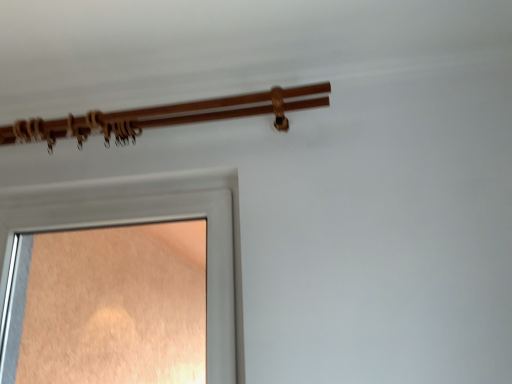
At what (x,y) coordinates should I click in order to perform the action: click on brown wooden clothesline at upper center. Please return your answer as a coordinate pair (x, y). Looking at the image, I should click on (164, 117).

The height and width of the screenshot is (384, 512). Describe the element at coordinates (164, 117) in the screenshot. I see `brown wooden clothesline at upper center` at that location.

This screenshot has width=512, height=384. In order to click on brown wooden clothesline at upper center in this screenshot , I will do `click(164, 117)`.